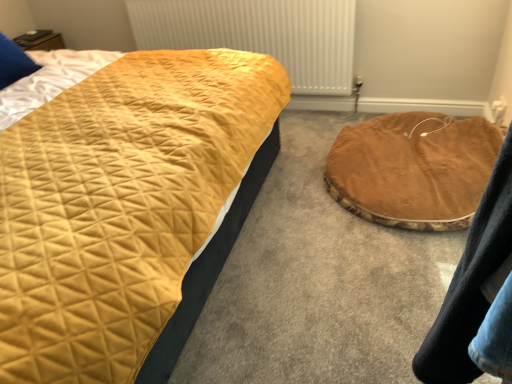
Question: Considering the positions of brown plush pet bed at center and metallic white radiator at upper center in the image, is brown plush pet bed at center taller or shorter than metallic white radiator at upper center?

Choices:
 (A) tall
 (B) short

Answer: (A)

Question: Is brown plush pet bed at center inside the boundaries of metallic white radiator at upper center, or outside?

Choices:
 (A) outside
 (B) inside

Answer: (A)

Question: Which object is positioned farthest from the metallic white radiator at upper center?

Choices:
 (A) brown velvety cat bed at lower right
 (B) brown plush pet bed at center

Answer: (B)

Question: Estimate the real-world distances between objects in this image. Which object is farther from the metallic white radiator at upper center?

Choices:
 (A) brown plush pet bed at center
 (B) brown velvety cat bed at lower right

Answer: (A)